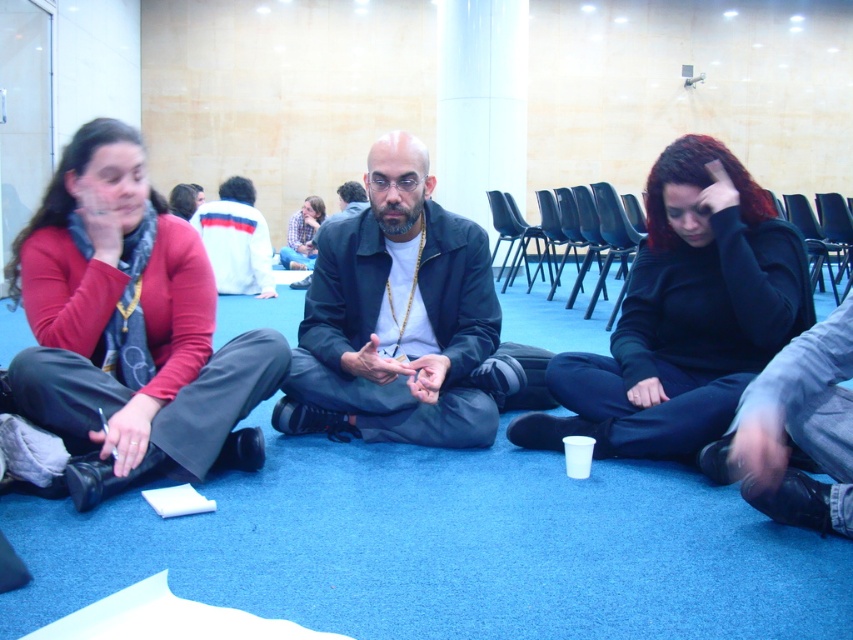
You are standing in the conference room and want to hand a document to the person wearing the black matte hoodie at center. If you are currently 2.11 meters away, is this within a comfortable distance for handing over the document without needing to move closer?

The distance between you and the black matte hoodie at center is exactly 2.11 meters. A comfortable distance for handing over a document is typically around 1 to 1.5 meters. Therefore, you would need to move closer to ensure a comfortable exchange.

You are standing in the conference room and see the white cotton jacket at upper center and the plaid shirt at center. Which one is positioned to the left?

The white cotton jacket at upper center is positioned to the left of the plaid shirt at center.